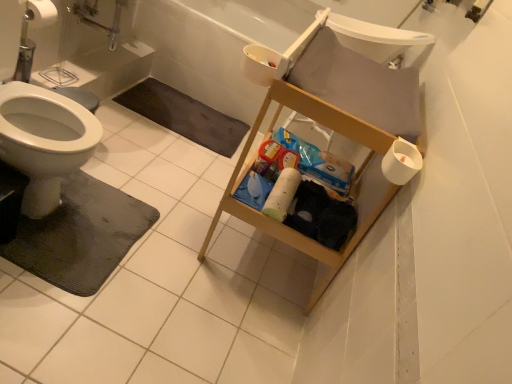
At what (x,y) coordinates should I click in order to perform the action: click on vacant space in black rubber bath mat at lower left, which is counted as the second bath mat, starting from the top (from a real-world perspective). Please return your answer as a coordinate pair (x, y). The width and height of the screenshot is (512, 384). Looking at the image, I should click on (99, 227).